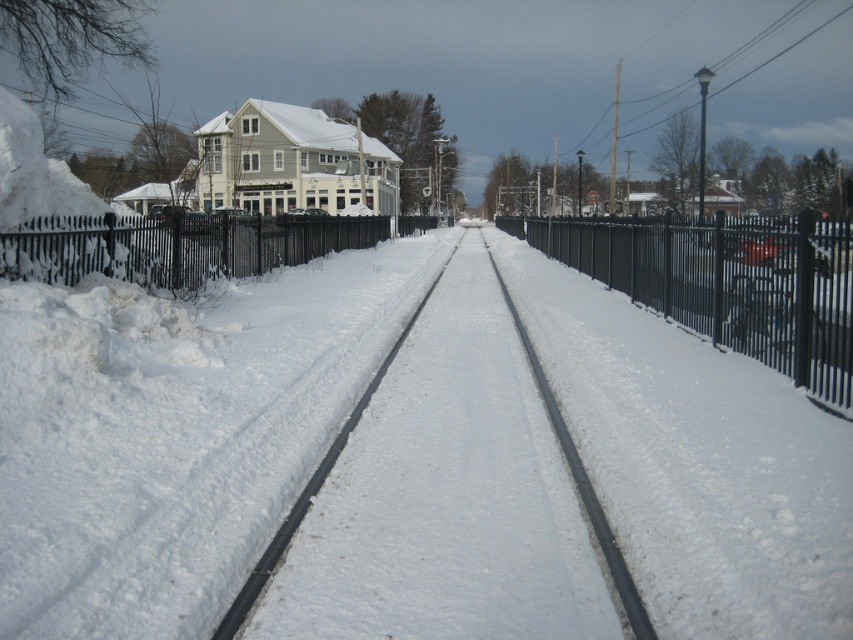
Does snow-covered metal tracks at center come behind black metal fence at center?

No, it is in front of black metal fence at center.

Does point (434, 486) lie in front of point (824, 260)?

That is True.

Describe the element at coordinates (447, 497) in the screenshot. I see `snow-covered metal tracks at center` at that location.

Identify the location of snow-covered metal tracks at center. (447, 497).

Can you confirm if snow-covered metal tracks at center is positioned above black wrought iron fence at left?

Actually, snow-covered metal tracks at center is below black wrought iron fence at left.

This screenshot has height=640, width=853. What do you see at coordinates (447, 497) in the screenshot?
I see `snow-covered metal tracks at center` at bounding box center [447, 497].

Where is `snow-covered metal tracks at center`? The image size is (853, 640). snow-covered metal tracks at center is located at coordinates (447, 497).

You are a GUI agent. You are given a task and a screenshot of the screen. Output one action in this format:
    pyautogui.click(x=<x>, y=<y>)
    Task: Click on the black metal fence at center
    The image size is (853, 640).
    Given the screenshot: What is the action you would take?
    pyautogui.click(x=726, y=282)

Is black metal fence at center shorter than black wrought iron fence at left?

No, black metal fence at center is not shorter than black wrought iron fence at left.

Describe the element at coordinates (726, 282) in the screenshot. I see `black metal fence at center` at that location.

The width and height of the screenshot is (853, 640). Identify the location of black metal fence at center. (726, 282).